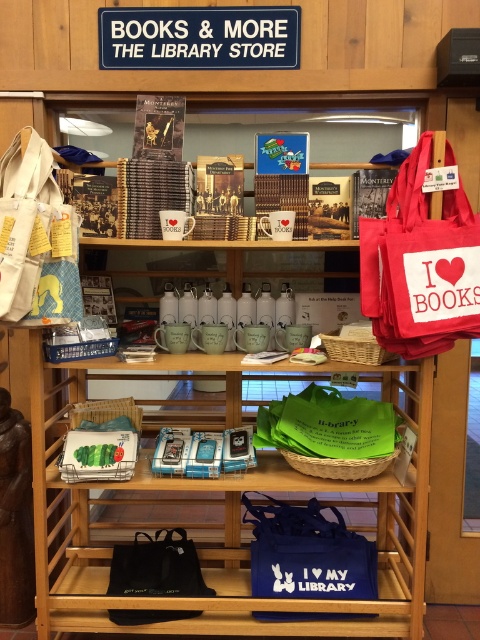
Between point (1, 284) and point (184, 538), which one is positioned in front?

Positioned in front is point (1, 284).

Which is more to the left, white canvas tote at left or black fabric tote at lower left?

From the viewer's perspective, white canvas tote at left appears more on the left side.

Measure the distance between point (x=3, y=257) and camera.

Point (x=3, y=257) and camera are 1.98 meters apart from each other.

Where is `white canvas tote at left`? white canvas tote at left is located at coordinates (27, 221).

Is red canvas tote at upper right positioned in front of black fabric tote at lower left?

Yes, it is in front of black fabric tote at lower left.

What do you see at coordinates (420, 264) in the screenshot?
I see `red canvas tote at upper right` at bounding box center [420, 264].

Find the location of a particular element. This screenshot has width=480, height=640. red canvas tote at upper right is located at coordinates (420, 264).

Can you confirm if red canvas tote at upper right is shorter than green fabric tote at center?

Incorrect, red canvas tote at upper right's height does not fall short of green fabric tote at center's.

Does point (431, 280) come closer to viewer compared to point (314, 435)?

Yes, it is.

Between point (408, 268) and point (291, 432), which one is positioned in front?

Point (408, 268) is more forward.

In order to click on red canvas tote at upper right in this screenshot , I will do `click(420, 264)`.